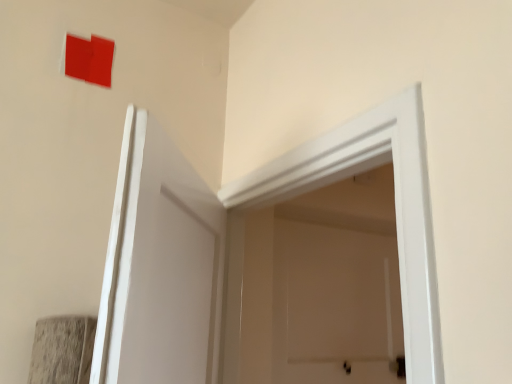
Question: Is white smooth door at center in front of or behind matte red square at upper left in the image?

Choices:
 (A) behind
 (B) front

Answer: (B)

Question: Is white smooth door at center wider or thinner than matte red square at upper left?

Choices:
 (A) thin
 (B) wide

Answer: (B)

Question: From the image's perspective, relative to matte red square at upper left, is white smooth door at center above or below?

Choices:
 (A) above
 (B) below

Answer: (B)

Question: In terms of height, does matte red square at upper left look taller or shorter compared to white smooth door at center?

Choices:
 (A) short
 (B) tall

Answer: (A)

Question: Looking at the image, does matte red square at upper left seem bigger or smaller compared to white smooth door at center?

Choices:
 (A) big
 (B) small

Answer: (B)

Question: Considering the positions of point (79, 69) and point (230, 264), is point (79, 69) closer or farther from the camera than point (230, 264)?

Choices:
 (A) closer
 (B) farther

Answer: (A)

Question: From the image's perspective, is matte red square at upper left located above or below white smooth door at center?

Choices:
 (A) below
 (B) above

Answer: (B)